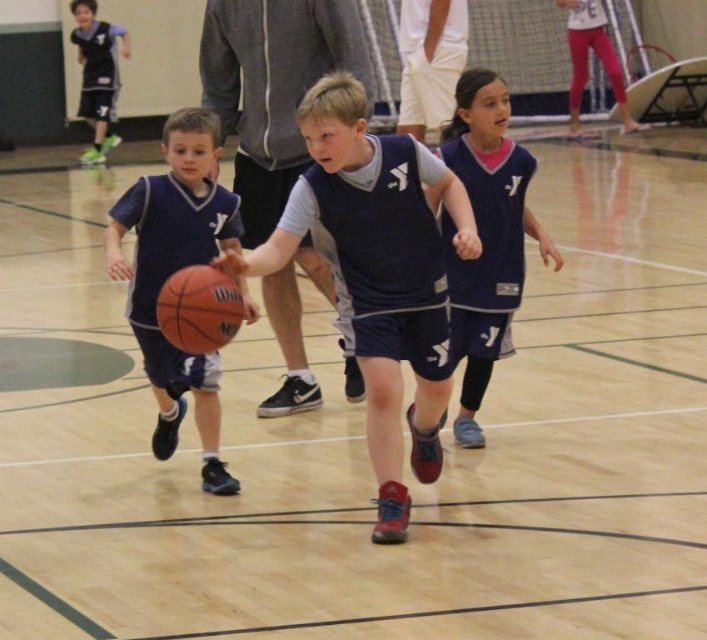
You are a referee watching the basketball game. You notice the rubber basketball at center and the navy blue jersey at center. Which object is closer to the front of the image?

The rubber basketball at center is closer to the front of the image because it is in front of the navy blue jersey at center.

Based on the scene description, where is the rubber basketball at center located in terms of coordinates?

The rubber basketball at center is located at coordinates point (366, 246).

You are a photographer trying to capture a closeup of the gray hoodie at center and the matte black shorts at upper left in the basketball game image. Which object would require you to zoom in more to fill the frame?

The gray hoodie at center requires more zooming in because it occupies less space in the frame compared to the matte black shorts at upper left.